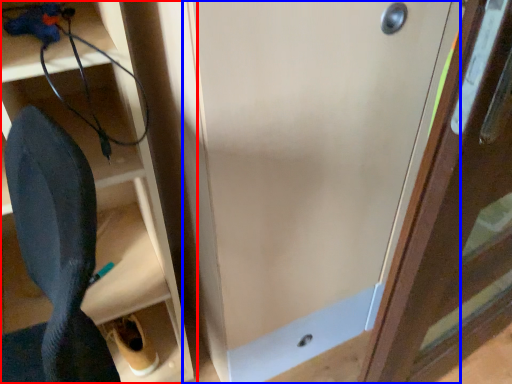
Question: Among these objects, which one is nearest to the camera, shelf (highlighted by a red box) or door (highlighted by a blue box)?

Choices:
 (A) shelf
 (B) door

Answer: (A)